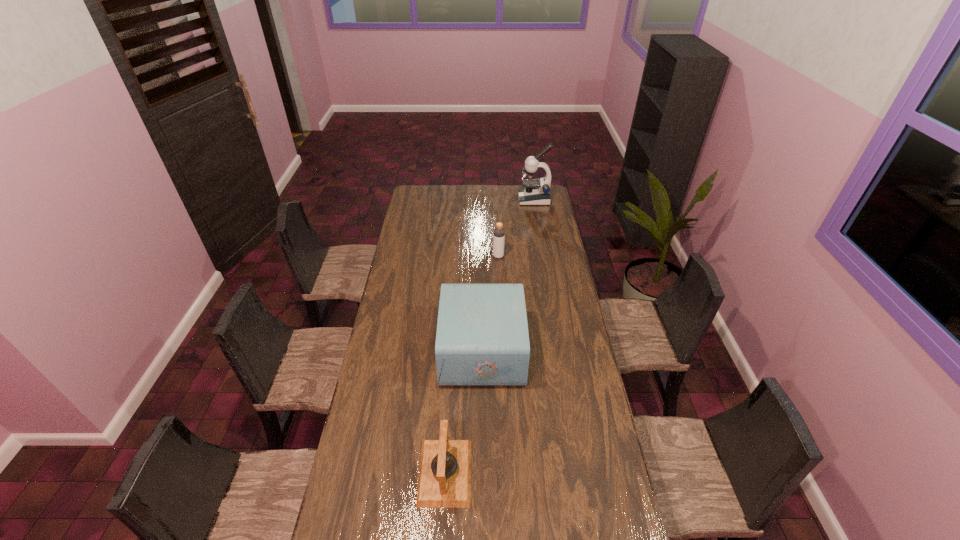
Where is `microscope`? The height and width of the screenshot is (540, 960). microscope is located at coordinates (535, 192).

This screenshot has width=960, height=540. In order to click on the rightmost object in this screenshot , I will do `click(535, 192)`.

I want to click on the third farthest object, so tap(482, 339).

You are a GUI agent. You are given a task and a screenshot of the screen. Output one action in this format:
    pyautogui.click(x=<x>, y=<y>)
    Task: Click on the bottle
    
    Given the screenshot: What is the action you would take?
    click(499, 233)

Image resolution: width=960 pixels, height=540 pixels. Identify the location of the shortest object. (444, 481).

Where is `the nearest object`? the nearest object is located at coordinates (444, 481).

Where is `vacant space located at the eyepiece of the rightmost object`? vacant space located at the eyepiece of the rightmost object is located at coordinates (483, 199).

You are a GUI agent. You are given a task and a screenshot of the screen. Output one action in this format:
    pyautogui.click(x=<x>, y=<y>)
    Task: Click on the vacant space located at the eyepiece of the rightmost object
    
    Given the screenshot: What is the action you would take?
    pyautogui.click(x=486, y=199)

What are the coordinates of `vacant space located 0.080m at the eyepiece of the rightmost object` in the screenshot? It's located at (506, 199).

Where is `vacant space situated on the front panel of the radio receiver`? vacant space situated on the front panel of the radio receiver is located at coordinates (396, 350).